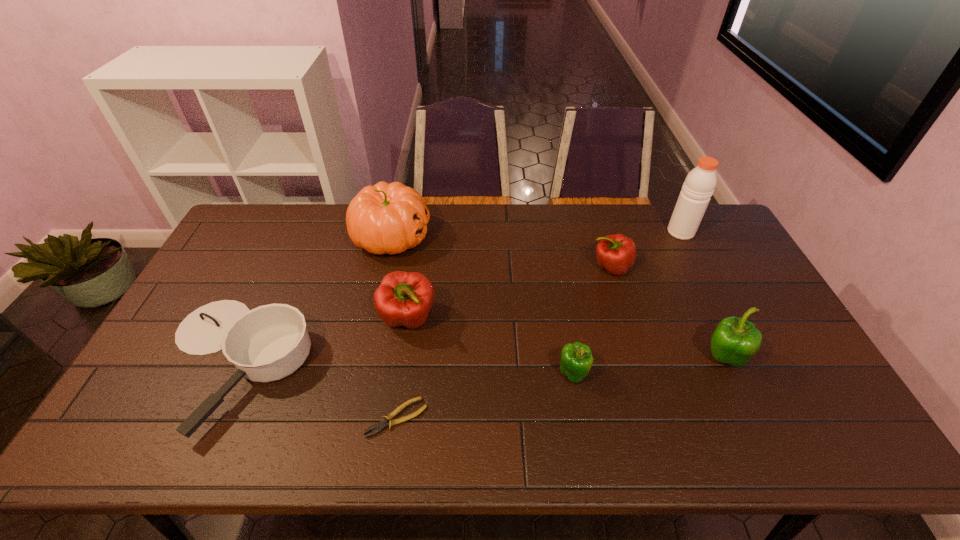
At what (x,y) coordinates should I click in order to perform the action: click on the right pink bell pepper. Please return your answer as a coordinate pair (x, y). Looking at the image, I should click on (616, 253).

The height and width of the screenshot is (540, 960). I want to click on saucepan, so click(x=270, y=342).

In order to click on the shortest object in this screenshot , I will do `click(379, 426)`.

You are a GUI agent. You are given a task and a screenshot of the screen. Output one action in this format:
    pyautogui.click(x=<x>, y=<y>)
    Task: Click on the pliers
    The image size is (960, 540).
    Given the screenshot: What is the action you would take?
    pyautogui.click(x=379, y=426)

Locate an element on the screen. The image size is (960, 540). blank area located on the left of the tallest object is located at coordinates (562, 232).

Locate an element on the screen. The width and height of the screenshot is (960, 540). vacant space located 0.170m on the carved face of the orange pumpkin is located at coordinates (480, 237).

Where is `free location located on the right of the right green bell pepper`? The image size is (960, 540). free location located on the right of the right green bell pepper is located at coordinates (786, 359).

Where is `vacant space located 0.270m on the front of the left pink bell pepper`? vacant space located 0.270m on the front of the left pink bell pepper is located at coordinates (392, 433).

This screenshot has width=960, height=540. I want to click on free space located on the front of the second bell pepper from left to right, so click(585, 440).

This screenshot has width=960, height=540. I want to click on vacant region located 0.120m on the left of the right pink bell pepper, so click(x=554, y=267).